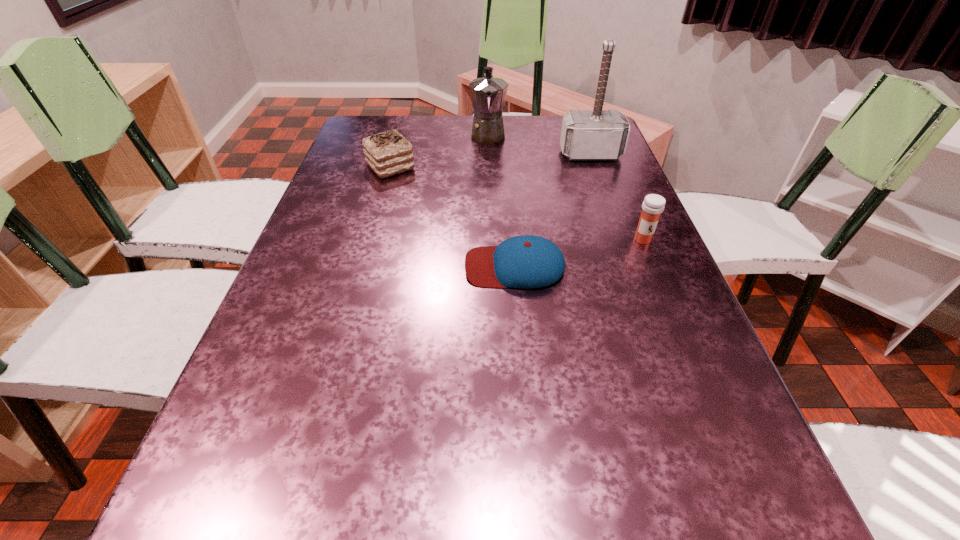
This screenshot has height=540, width=960. Identify the location of free space between the coffeepot and the medicine. (565, 187).

The image size is (960, 540). What are the coordinates of `unoccupied area between the medicine and the shortest object` in the screenshot? It's located at (579, 253).

Find the location of a particular element. unoccupied position between the tallest object and the second tallest object is located at coordinates (540, 144).

This screenshot has width=960, height=540. I want to click on object that stands as the third closest to the chocolate cake, so click(597, 134).

Identify the location of object identified as the third closest to the hammer. pos(527,261).

Find the location of a particular element. The width and height of the screenshot is (960, 540). free point that satisfies the following two spatial constraints: 1. for striking with the head of the hammer; 2. with the bill of the baseball cap facing forward is located at coordinates pos(631,266).

You are a GUI agent. You are given a task and a screenshot of the screen. Output one action in this format:
    pyautogui.click(x=<x>, y=<y>)
    Task: Click on the vacant space that satisfies the following two spatial constraints: 1. on the label side of the medicine; 2. with the bill of the shortest object facing forward
    The height and width of the screenshot is (540, 960).
    Given the screenshot: What is the action you would take?
    pyautogui.click(x=654, y=266)

Find the location of `vacant space that satisfies the following two spatial constraints: 1. on the label side of the medicine; 2. with the bill of the baseball cap facing forward`. vacant space that satisfies the following two spatial constraints: 1. on the label side of the medicine; 2. with the bill of the baseball cap facing forward is located at coordinates (654, 266).

Find the location of a particular element. The width and height of the screenshot is (960, 540). free space in the image that satisfies the following two spatial constraints: 1. for striking with the head of the hammer; 2. with the bill of the shortest object facing forward is located at coordinates (631, 266).